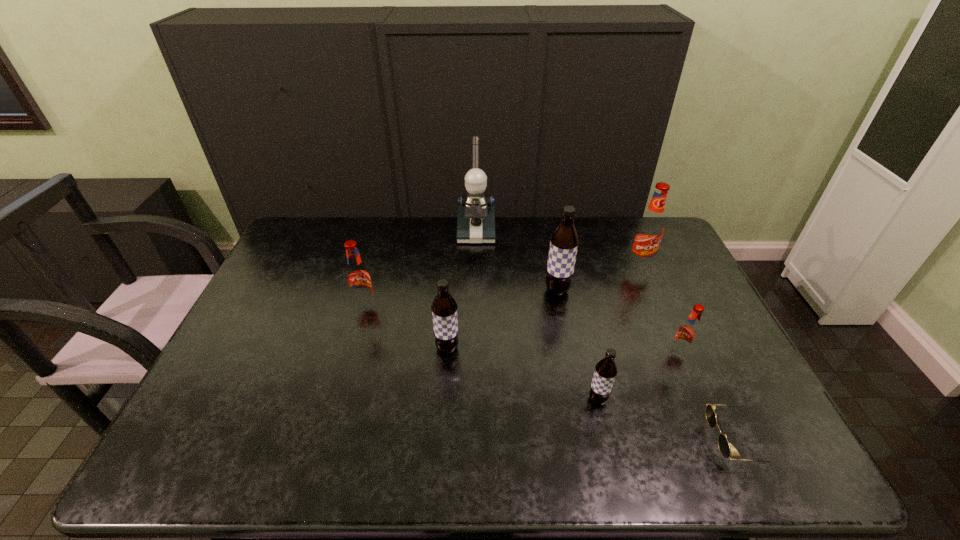
Find the location of a particular element. Image resolution: width=960 pixels, height=540 pixels. brown root beer object that ranks as the second closest to the biggest brown root beer is located at coordinates [605, 372].

Where is `vacant position in the image that satisfies the following two spatial constraints: 1. on the front side of the second nearest brown root beer; 2. on the left side of the seventh farthest object`? The width and height of the screenshot is (960, 540). vacant position in the image that satisfies the following two spatial constraints: 1. on the front side of the second nearest brown root beer; 2. on the left side of the seventh farthest object is located at coordinates (444, 399).